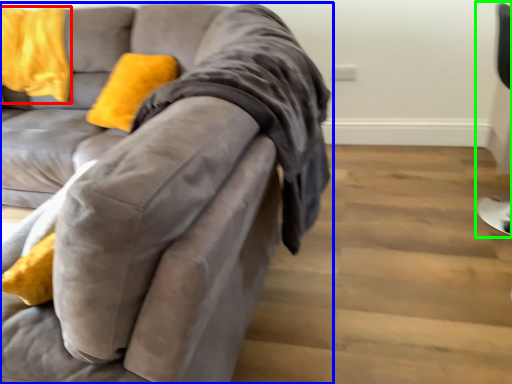
Question: Which object is positioned closest to pillow (highlighted by a red box)? Select from studio couch (highlighted by a blue box) and computer chair (highlighted by a green box).

Choices:
 (A) studio couch
 (B) computer chair

Answer: (A)